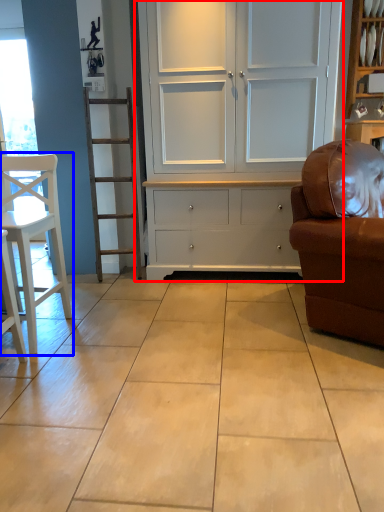
Question: Which object appears closest to the camera in this image, cupboard (highlighted by a red box) or chair (highlighted by a blue box)?

Choices:
 (A) cupboard
 (B) chair

Answer: (B)